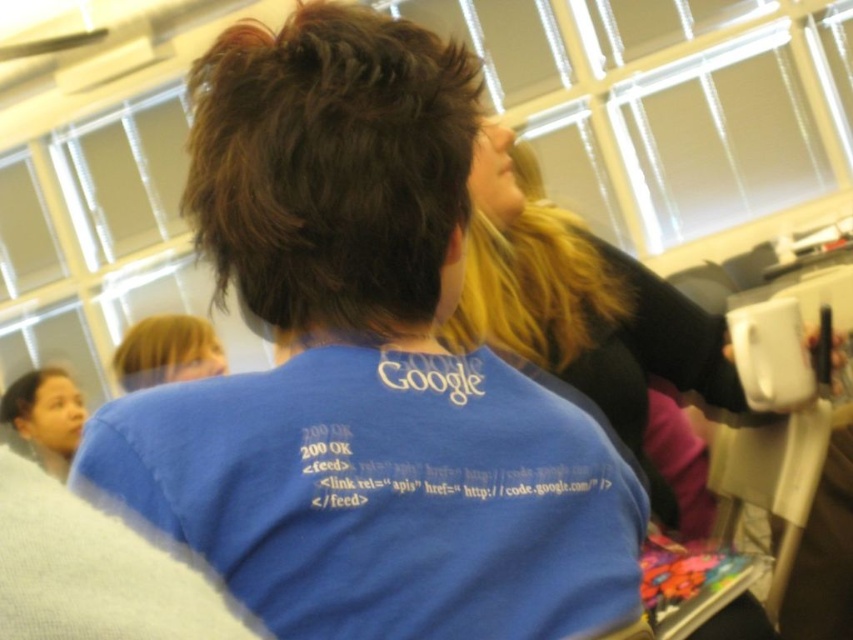
Can you confirm if blue cotton t-shirt at center is smaller than dark brown textured hair at center?

Yes, blue cotton t-shirt at center is smaller than dark brown textured hair at center.

In the scene shown: Does blue cotton t-shirt at center appear over dark brown textured hair at center?

No.

Is point (328, 460) behind point (440, 112)?

No.

Image resolution: width=853 pixels, height=640 pixels. Find the location of `blue cotton t-shirt at center`. blue cotton t-shirt at center is located at coordinates tap(381, 496).

Which of these two, blonde hair at upper left or brown matte hair at upper left, stands shorter?

With less height is blonde hair at upper left.

Is point (181, 353) positioned behind point (57, 372)?

No, (181, 353) is in front of (57, 372).

This screenshot has height=640, width=853. Identify the location of blonde hair at upper left. coord(167,352).

Is point (282, 76) positioned before point (543, 364)?

That is True.

Does dark brown textured hair at center come in front of blonde silky hair at upper center?

Yes, dark brown textured hair at center is closer to the viewer.

The width and height of the screenshot is (853, 640). Identify the location of dark brown textured hair at center. (331, 170).

Locate an element on the screen. The height and width of the screenshot is (640, 853). dark brown textured hair at center is located at coordinates (331, 170).